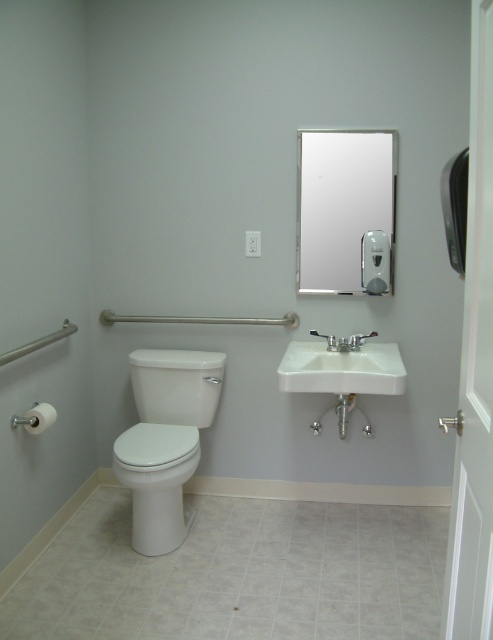
Who is positioned more to the right, white ceramic sink at center or satin nickel faucet at sink right?

Positioned to the right is white ceramic sink at center.

Is white ceramic sink at center above satin nickel faucet at sink right?

No.

Is point (398, 392) more distant than point (316, 333)?

That is False.

Where is `white ceramic sink at center`? white ceramic sink at center is located at coordinates (342, 369).

Who is lower down, clear glass mirror at upper center or satin nickel faucet at sink right?

satin nickel faucet at sink right

Can you confirm if clear glass mirror at upper center is positioned to the left of satin nickel faucet at sink right?

Incorrect, clear glass mirror at upper center is not on the left side of satin nickel faucet at sink right.

Is point (323, 262) behind point (331, 342)?

Yes.

Locate an element on the screen. The width and height of the screenshot is (493, 640). clear glass mirror at upper center is located at coordinates (346, 211).

Can you confirm if clear glass mirror at upper center is positioned above white glossy toilet at lower left?

Correct, clear glass mirror at upper center is located above white glossy toilet at lower left.

Which of these two, clear glass mirror at upper center or white glossy toilet at lower left, stands taller?

white glossy toilet at lower left is taller.

Measure the distance between clear glass mirror at upper center and camera.

clear glass mirror at upper center and camera are 2.69 meters apart.

Locate an element on the screen. The height and width of the screenshot is (640, 493). clear glass mirror at upper center is located at coordinates (346, 211).